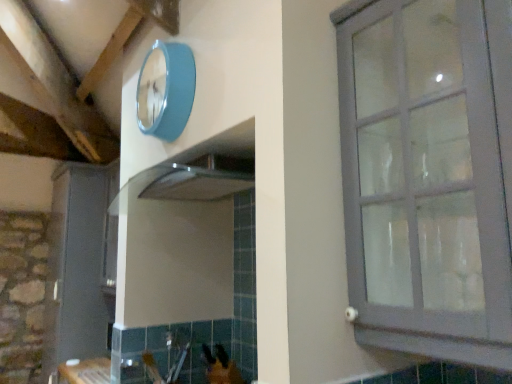
Question: Is matte gray cabinet at right wider or thinner than matte gray cabinet at left?

Choices:
 (A) thin
 (B) wide

Answer: (A)

Question: Does point (365, 99) appear closer or farther from the camera than point (70, 337)?

Choices:
 (A) closer
 (B) farther

Answer: (A)

Question: Which object is positioned closest to the matte gray cabinet at left?

Choices:
 (A) teal glossy clock at upper center
 (B) matte gray cabinet at right

Answer: (A)

Question: Which is nearer to the matte gray cabinet at left?

Choices:
 (A) teal glossy clock at upper center
 (B) matte gray cabinet at right

Answer: (A)